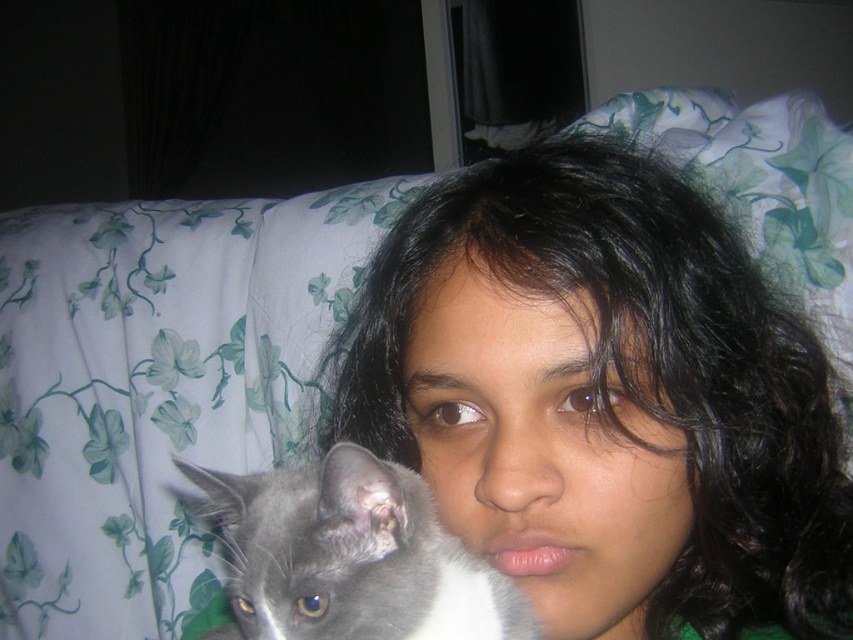
What is located at the coordinate point (605,397) in the image?

At point (605,397) lies black matte hair at center.

You are a photographer trying to capture a close portrait of the black matte hair at center and the gray soft fur cat at lower left. Since you want to focus on the hair, you need to know which object is wider to adjust your camera settings. Which one is wider?

The black matte hair at center is wider than the gray soft fur cat at lower left according to the description, so you should adjust your camera settings to focus on the wider black matte hair at center.

You are a photographer trying to capture a close shot of the gray soft fur cat at lower left. You are currently focused on the black matte hair at center. Can you adjust your camera to focus on the cat without moving your position?

The black matte hair at center is further to the viewer than gray soft fur cat at lower left. Since the cat is closer to you than the hair, you can adjust the camera focus to the nearer object, which is the gray soft fur cat at lower left, without moving your position.